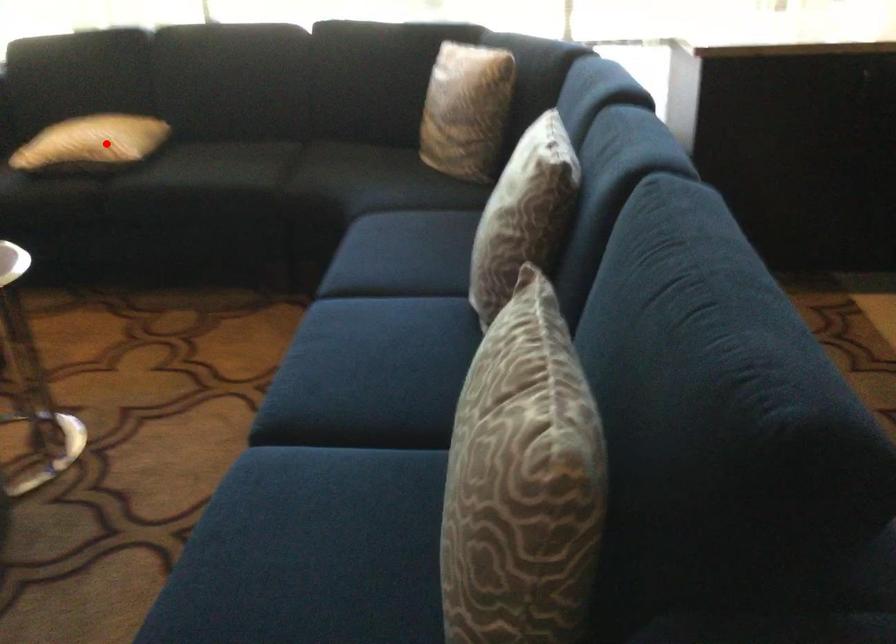
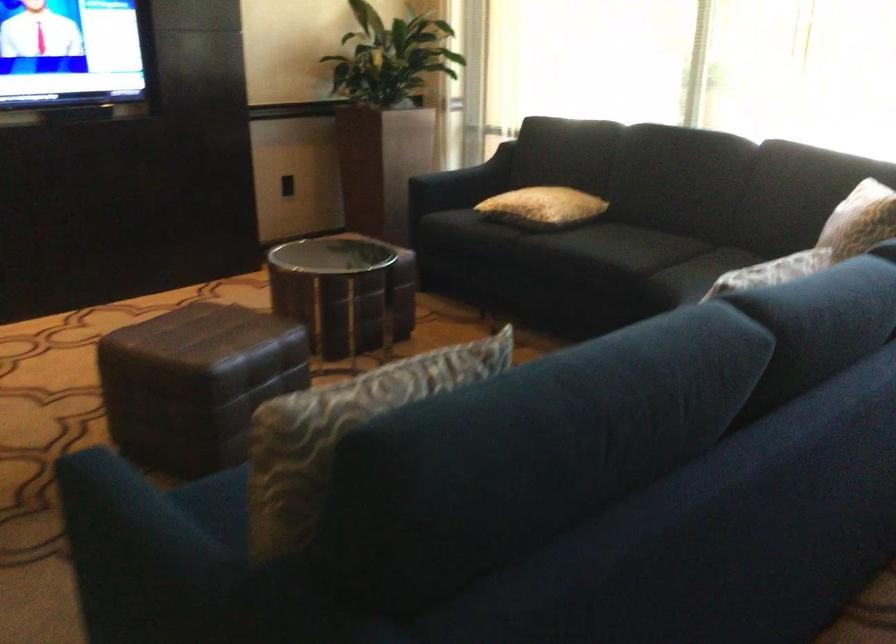
Question: I am providing you with two images of the same scene from different viewpoints. In image1, a red point is highlighted. Considering the same 3D point in image2, which of the following is correct?

Choices:
 (A) It is closer
 (B) It is farther

Answer: (B)